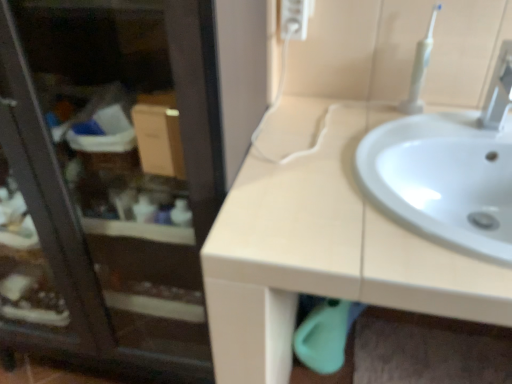
Describe the element at coordinates (498, 90) in the screenshot. I see `white plastic tap at upper right` at that location.

Locate an element on the screen. white plastic toothbrush at upper right is located at coordinates (420, 69).

Describe the element at coordinates (448, 172) in the screenshot. I see `white glossy sink at center` at that location.

This screenshot has width=512, height=384. Find the location of `beige matte sink at upper right`. beige matte sink at upper right is located at coordinates (321, 246).

Where is `transparent glass screen door at upper left`? transparent glass screen door at upper left is located at coordinates (106, 183).

Consider the image. Is beige matte sink at upper right at the back of transparent glass screen door at upper left?

transparent glass screen door at upper left does not have its back to beige matte sink at upper right.

Based on the photo, between transparent glass screen door at upper left and beige matte sink at upper right, which one has less height?

With less height is beige matte sink at upper right.

Between transparent glass screen door at upper left and beige matte sink at upper right, which one has larger size?

With larger size is beige matte sink at upper right.

How far apart are transparent glass screen door at upper left and beige matte sink at upper right?

transparent glass screen door at upper left and beige matte sink at upper right are 13.39 inches apart.

Is white plastic toothbrush at upper right wider or thinner than white glossy sink at center?

Clearly, white plastic toothbrush at upper right has less width compared to white glossy sink at center.

Looking at this image, is white plastic toothbrush at upper right directly adjacent to white glossy sink at center?

white plastic toothbrush at upper right and white glossy sink at center are clearly separated.

Considering the relative positions of white plastic toothbrush at upper right and white glossy sink at center in the image provided, is white plastic toothbrush at upper right to the left of white glossy sink at center from the viewer's perspective?

Indeed, white plastic toothbrush at upper right is positioned on the left side of white glossy sink at center.

This screenshot has width=512, height=384. What are the coordinates of `toothbrush behind the white glossy sink at center` in the screenshot? It's located at (420, 69).

Between point (376, 171) and point (422, 69), which one is positioned behind?

Point (422, 69)

From the image's perspective, is white glossy sink at center on white plastic toothbrush at upper right?

No.

Is white glossy sink at center facing away from white plastic toothbrush at upper right?

No, white glossy sink at center's orientation is not away from white plastic toothbrush at upper right.

Based on the photo, which of these two, beige matte sink at upper right or white plastic tap at upper right, stands taller?

With more height is beige matte sink at upper right.

Does point (292, 312) come farther from viewer compared to point (498, 121)?

Yes, it is behind point (498, 121).

Can you tell me how much beige matte sink at upper right and white plastic tap at upper right differ in facing direction?

The angle between the facing direction of beige matte sink at upper right and the facing direction of white plastic tap at upper right is 1.19 degrees.

Is beige matte sink at upper right situated inside white plastic tap at upper right or outside?

beige matte sink at upper right lies outside white plastic tap at upper right.

Considering the points (378, 206) and (496, 109), which point is behind, point (378, 206) or point (496, 109)?

Positioned behind is point (496, 109).

The height and width of the screenshot is (384, 512). In the image, there is a white plastic tap at upper right. What are the coordinates of `sink below it (from a real-world perspective)` in the screenshot? It's located at (448, 172).

Would you say white glossy sink at center is to the left or to the right of white plastic tap at upper right in the picture?

Based on their positions, white glossy sink at center is located to the left of white plastic tap at upper right.

How distant is white glossy sink at center from white plastic tap at upper right?

white glossy sink at center and white plastic tap at upper right are 6.23 inches apart from each other.

You are a GUI agent. You are given a task and a screenshot of the screen. Output one action in this format:
    pyautogui.click(x=<x>, y=<y>)
    Task: Click on the toothbrush above the beige matte sink at upper right (from the image's perspective)
    This screenshot has width=512, height=384.
    Given the screenshot: What is the action you would take?
    pyautogui.click(x=420, y=69)

Considering the positions of objects beige matte sink at upper right and white plastic toothbrush at upper right in the image provided, who is in front, beige matte sink at upper right or white plastic toothbrush at upper right?

beige matte sink at upper right.

Is beige matte sink at upper right facing towards white plastic toothbrush at upper right?

No.

Is point (425, 53) closer or farther from the camera than point (500, 57)?

Clearly, point (425, 53) is more distant from the camera than point (500, 57).

Is white plastic toothbrush at upper right placed right next to white plastic tap at upper right?

No, white plastic toothbrush at upper right is not making contact with white plastic tap at upper right.

From the image's perspective, is white plastic toothbrush at upper right located above white plastic tap at upper right?

Yes, from the image's perspective, white plastic toothbrush at upper right is above white plastic tap at upper right.

I want to click on screen door on the left of beige matte sink at upper right, so click(x=106, y=183).

Where is `toothbrush located above the white glossy sink at center (from the image's perspective)`? The image size is (512, 384). toothbrush located above the white glossy sink at center (from the image's perspective) is located at coordinates (420, 69).

Looking at the image, which one is located closer to beige matte sink at upper right, transparent glass screen door at upper left or white plastic tap at upper right?

transparent glass screen door at upper left is closer to beige matte sink at upper right.

From the picture: When comparing their distances from transparent glass screen door at upper left, does white plastic toothbrush at upper right or white glossy sink at center seem closer?

white glossy sink at center lies closer to transparent glass screen door at upper left than the other object.

Looking at this image, looking at the image, which one is located further to white glossy sink at center, white plastic tap at upper right or transparent glass screen door at upper left?

transparent glass screen door at upper left.

Based on their spatial positions, is white plastic toothbrush at upper right or beige matte sink at upper right further from white plastic tap at upper right?

beige matte sink at upper right is positioned further to the anchor white plastic tap at upper right.

Which object lies further to the anchor point white plastic toothbrush at upper right, transparent glass screen door at upper left or white glossy sink at center?

transparent glass screen door at upper left is positioned further to the anchor white plastic toothbrush at upper right.

Considering their positions, is white plastic toothbrush at upper right positioned closer to beige matte sink at upper right than white plastic tap at upper right?

white plastic toothbrush at upper right is positioned closer to the anchor beige matte sink at upper right.

In the scene shown: Which object lies further to the anchor point white plastic toothbrush at upper right, white plastic tap at upper right or white glossy sink at center?

white glossy sink at center is positioned further to the anchor white plastic toothbrush at upper right.

Estimate the real-world distances between objects in this image. Which object is closer to beige matte sink at upper right, white plastic tap at upper right or white plastic toothbrush at upper right?

white plastic toothbrush at upper right is closer to beige matte sink at upper right.

At what (x,y) coordinates should I click in order to perform the action: click on sink between white plastic toothbrush at upper right and beige matte sink at upper right in the up-down direction. Please return your answer as a coordinate pair (x, y). Image resolution: width=512 pixels, height=384 pixels. Looking at the image, I should click on (448, 172).

You are a GUI agent. You are given a task and a screenshot of the screen. Output one action in this format:
    pyautogui.click(x=<x>, y=<y>)
    Task: Click on the sink between white plastic tap at upper right and beige matte sink at upper right in the vertical direction
    This screenshot has width=512, height=384.
    Given the screenshot: What is the action you would take?
    pyautogui.click(x=448, y=172)

Identify the location of countertop located between transparent glass screen door at upper left and white plastic tap at upper right in the left-right direction. (321, 246).

I want to click on sink situated between transparent glass screen door at upper left and beige matte sink at upper right from left to right, so click(x=448, y=172).